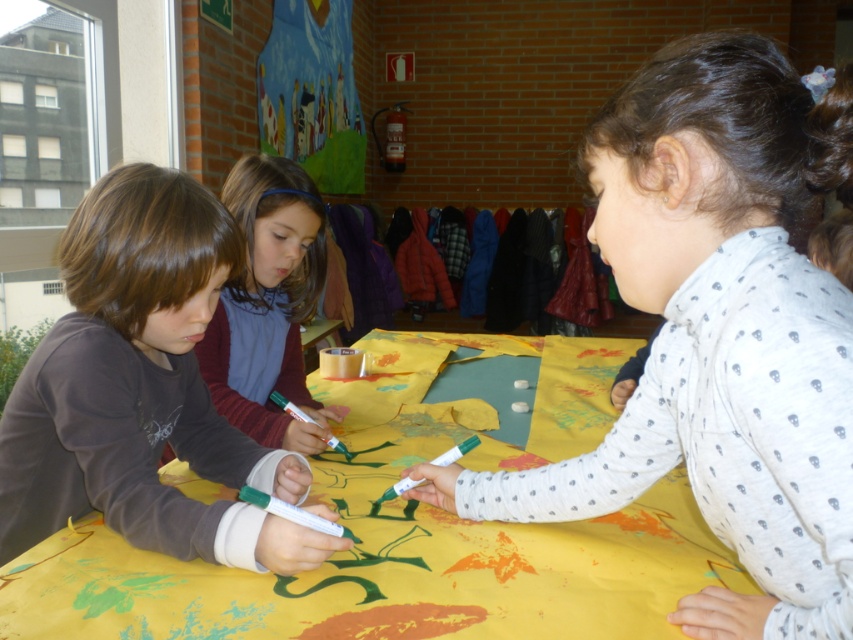
Who is lower down, dark brown hair at left or matte brown shirt at center?

dark brown hair at left is lower down.

Is point (183, 390) more distant than point (277, 268)?

No, it is not.

What do you see at coordinates (141, 388) in the screenshot? This screenshot has width=853, height=640. I see `dark brown hair at left` at bounding box center [141, 388].

Locate an element on the screen. dark brown hair at left is located at coordinates (141, 388).

Is yellow paper at center closer to camera compared to matte brown shirt at center?

Yes, yellow paper at center is closer to the viewer.

Who is positioned more to the left, yellow paper at center or matte brown shirt at center?

matte brown shirt at center

Image resolution: width=853 pixels, height=640 pixels. What do you see at coordinates (387, 566) in the screenshot? I see `yellow paper at center` at bounding box center [387, 566].

Locate an element on the screen. yellow paper at center is located at coordinates (387, 566).

Is yellow paper at center further to camera compared to dark brown hair at left?

No, yellow paper at center is in front of dark brown hair at left.

Between yellow paper at center and dark brown hair at left, which one appears on the left side from the viewer's perspective?

From the viewer's perspective, dark brown hair at left appears more on the left side.

You are a GUI agent. You are given a task and a screenshot of the screen. Output one action in this format:
    pyautogui.click(x=<x>, y=<y>)
    Task: Click on the yellow paper at center
    This screenshot has width=853, height=640.
    Given the screenshot: What is the action you would take?
    pyautogui.click(x=387, y=566)

At what (x,y) coordinates should I click in order to perform the action: click on yellow paper at center. Please return your answer as a coordinate pair (x, y). The width and height of the screenshot is (853, 640). Looking at the image, I should click on pyautogui.click(x=387, y=566).